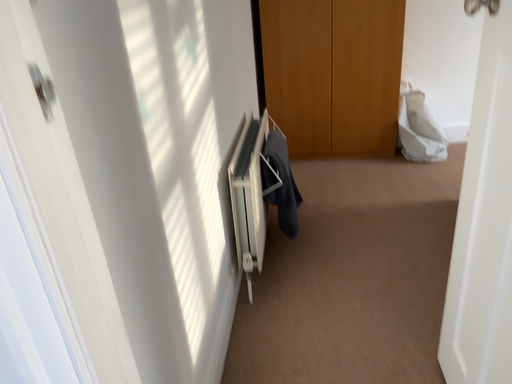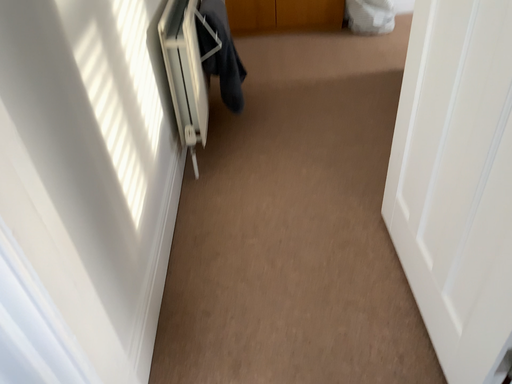
Question: Which way did the camera rotate in the video?

Choices:
 (A) rotated left
 (B) rotated right

Answer: (B)